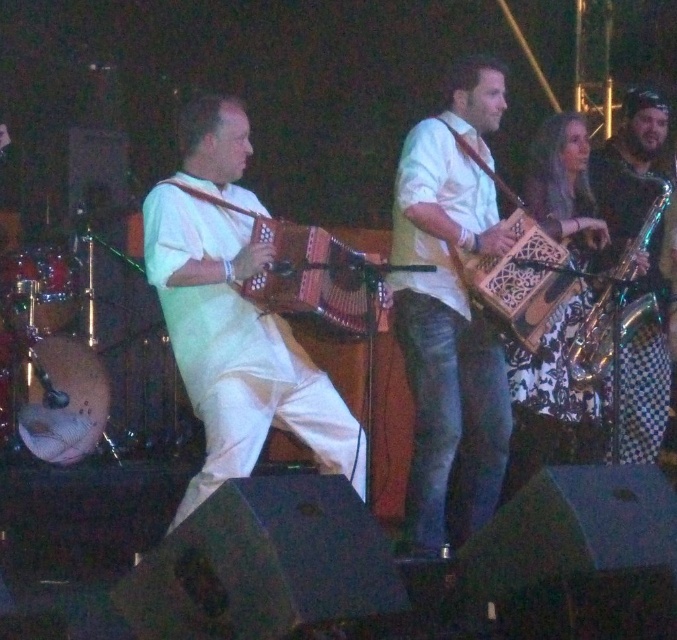
You are a photographer standing at the center of the stage. You want to take a photo that includes both the point at coordinates point (238, 276) and point (529, 312). Which point should you focus on first to ensure both are in frame?

Since point (238, 276) is in front of point (529, 312), you should focus on point (238, 276) first to ensure both are within the frame as the foreground point will be closer to your camera position.

You are a stagehand setting up a music stand for the next performer. The stand is 1.2 meters tall. You need to place it between the two accordions. Considering their heights, will the stand be taller than both the matte wooden accordion at left and the wooden carved accordion at center?

The matte wooden accordion at left has a greater height compared to the wooden carved accordion at center. Since the stand is 1.2 meters tall, it will only be taller than the wooden carved accordion at center if the matte wooden accordion at left is shorter than 1.2 meters. However, since the matte wooden accordion at left is taller than the wooden carved one, but we don not have exact measurements, we cannot definitively determine if the stand is taller than both.

You are a stagehand setting up microphones for the two accordions. The microphone stands are only tall enough to reach instruments up to 50 cm in height. Based on the scene, will both the matte wooden accordion at left and the wooden carved accordion at center fit under the microphone stands?

The matte wooden accordion at left is larger in size than the wooden carved accordion at center. Since the microphone stands can only accommodate instruments up to 50 cm, it depends on the exact height of the larger accordion. If the matte wooden accordion at left exceeds 50 cm in height, it won